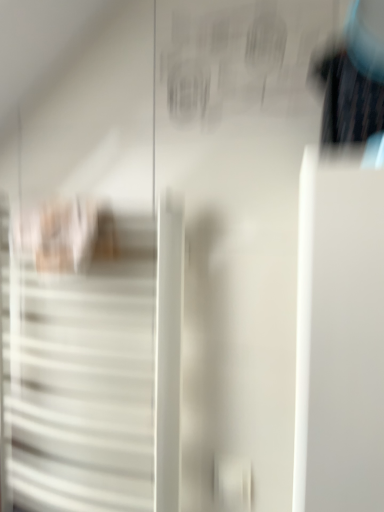
Question: Is black glossy hairbrush at upper right taller or shorter than white matte door at left?

Choices:
 (A) tall
 (B) short

Answer: (B)

Question: In the image, is black glossy hairbrush at upper right positioned in front of or behind white matte door at left?

Choices:
 (A) front
 (B) behind

Answer: (A)

Question: From the image's perspective, is black glossy hairbrush at upper right located above or below white matte door at left?

Choices:
 (A) above
 (B) below

Answer: (A)

Question: Is white matte door at left in front of or behind black glossy hairbrush at upper right in the image?

Choices:
 (A) behind
 (B) front

Answer: (A)

Question: Is point (89, 385) closer or farther from the camera than point (359, 96)?

Choices:
 (A) farther
 (B) closer

Answer: (A)

Question: Is white matte door at left to the left or to the right of black glossy hairbrush at upper right in the image?

Choices:
 (A) right
 (B) left

Answer: (B)

Question: Is white matte door at left situated inside black glossy hairbrush at upper right or outside?

Choices:
 (A) inside
 (B) outside

Answer: (B)